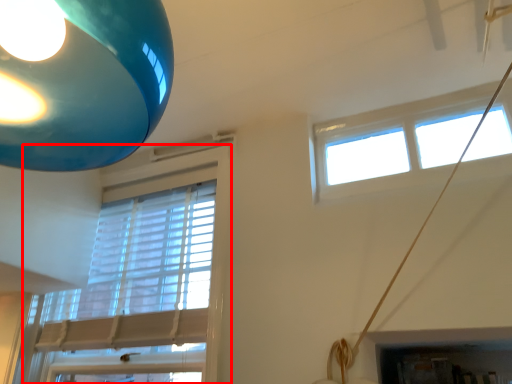
Question: From the image's perspective, where is window (annotated by the red box) located in relation to window in the image?

Choices:
 (A) above
 (B) below

Answer: (B)